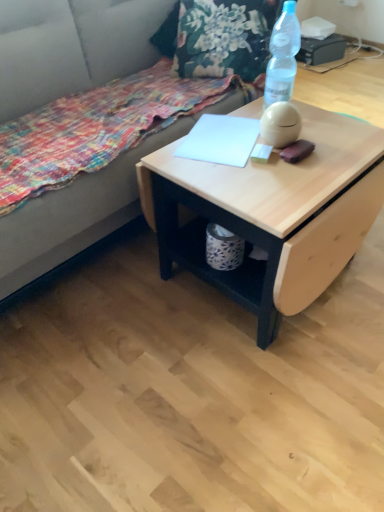
Locate an element on the screen. vacant area in front of natural wood desk at center is located at coordinates (253, 398).